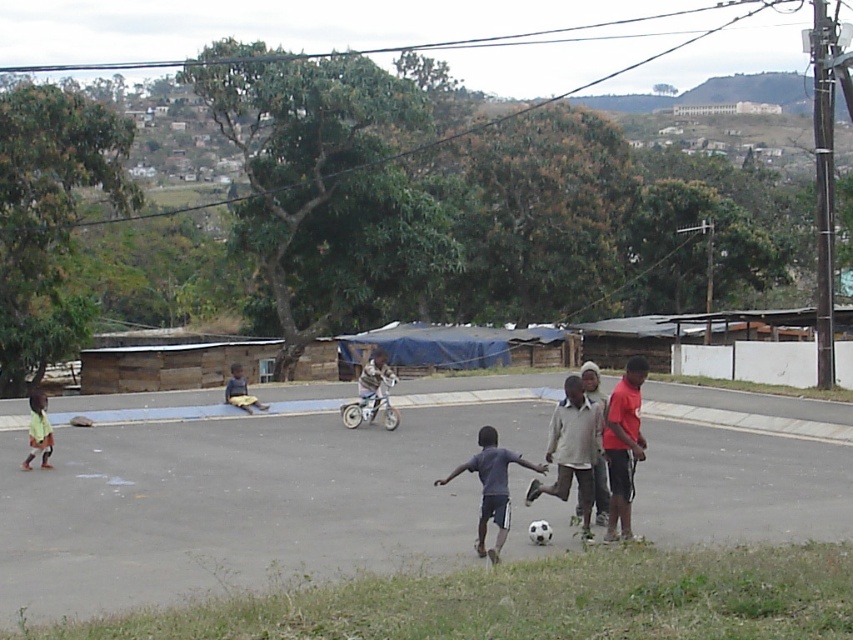
Who is higher up, dark blue jersey at center or light brown wooden bench at center?

Positioned higher is light brown wooden bench at center.

Is point (485, 515) positioned behind point (230, 374)?

No, (485, 515) is closer to viewer.

The height and width of the screenshot is (640, 853). Find the location of `dark blue jersey at center`. dark blue jersey at center is located at coordinates (491, 486).

Is point (495, 497) positioned behind point (41, 412)?

No, (495, 497) is in front of (41, 412).

Which is below, dark blue jersey at center or light green shirt at lower left?

dark blue jersey at center is below.

Does point (491, 484) come behind point (32, 422)?

No, it is not.

Identify the location of dark blue jersey at center. This screenshot has height=640, width=853. (491, 486).

In the scene shown: Who is more distant from viewer, (578, 378) or (229, 396)?

Positioned behind is point (229, 396).

Is light gray cotton shirt at center positioned in front of light brown wooden bench at center?

That is True.

What do you see at coordinates (572, 449) in the screenshot?
I see `light gray cotton shirt at center` at bounding box center [572, 449].

You are a GUI agent. You are given a task and a screenshot of the screen. Output one action in this format:
    pyautogui.click(x=<x>, y=<y>)
    Task: Click on the light gray cotton shirt at center
    This screenshot has height=640, width=853.
    Given the screenshot: What is the action you would take?
    pyautogui.click(x=572, y=449)